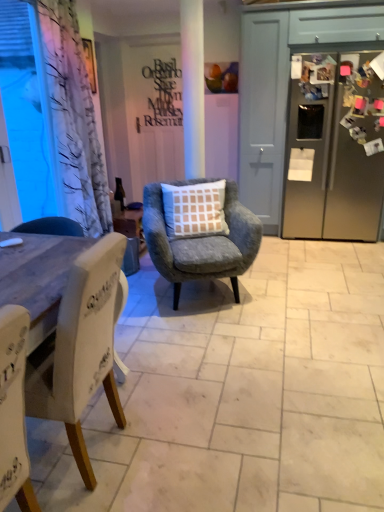
Question: Is the position of white matte door at center less distant than that of white fabric chair at left, which ranks as the second chair in right-to-left order?

Choices:
 (A) no
 (B) yes

Answer: (A)

Question: Does white matte door at center lie behind white fabric chair at left, positioned as the 1th chair in front-to-back order?

Choices:
 (A) no
 (B) yes

Answer: (B)

Question: Is white matte door at center next to white fabric chair at left, which appears as the first chair when viewed from the left?

Choices:
 (A) no
 (B) yes

Answer: (A)

Question: Considering the relative sizes of white matte door at center and white fabric chair at left, which appears as the first chair when viewed from the left, in the image provided, is white matte door at center shorter than white fabric chair at left, which appears as the first chair when viewed from the left,?

Choices:
 (A) no
 (B) yes

Answer: (A)

Question: Considering the relative positions of white matte door at center and white fabric chair at left, which appears as the first chair when viewed from the left, in the image provided, is white matte door at center to the left of white fabric chair at left, which appears as the first chair when viewed from the left, from the viewer's perspective?

Choices:
 (A) no
 (B) yes

Answer: (A)

Question: From the image's perspective, relative to satin silver refrigerator at right, is matte black writing at center above or below?

Choices:
 (A) below
 (B) above

Answer: (B)

Question: Is matte black writing at center inside or outside of satin silver refrigerator at right?

Choices:
 (A) outside
 (B) inside

Answer: (A)

Question: Looking at their shapes, would you say matte black writing at center is wider or thinner than satin silver refrigerator at right?

Choices:
 (A) wide
 (B) thin

Answer: (B)

Question: From a real-world perspective, is matte black writing at center above or below satin silver refrigerator at right?

Choices:
 (A) above
 (B) below

Answer: (A)

Question: In the image, is transparent plastic window screen at left on the left side or the right side of matte black writing at center?

Choices:
 (A) right
 (B) left

Answer: (B)

Question: Looking at the image, does transparent plastic window screen at left seem bigger or smaller compared to matte black writing at center?

Choices:
 (A) big
 (B) small

Answer: (A)

Question: Does point (31, 55) appear closer or farther from the camera than point (152, 110)?

Choices:
 (A) closer
 (B) farther

Answer: (A)

Question: From a real-world perspective, is transparent plastic window screen at left physically located above or below matte black writing at center?

Choices:
 (A) above
 (B) below

Answer: (B)

Question: Is point (56, 202) closer or farther from the camera than point (228, 250)?

Choices:
 (A) closer
 (B) farther

Answer: (B)

Question: From a real-world perspective, is transparent plastic window screen at left above or below velvet grey armchair with checkered cushion at center, the first chair viewed from the right?

Choices:
 (A) below
 (B) above

Answer: (B)